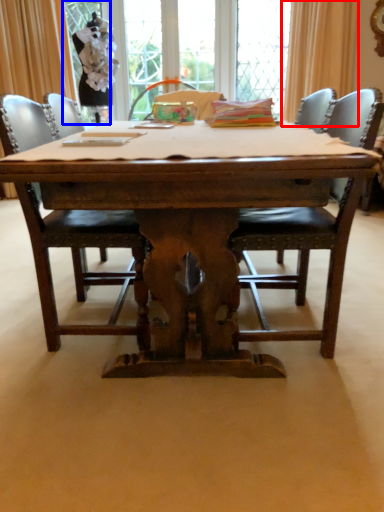
Question: Which object appears closest to the camera in this image, curtain (highlighted by a red box) or screen door (highlighted by a blue box)?

Choices:
 (A) curtain
 (B) screen door

Answer: (A)